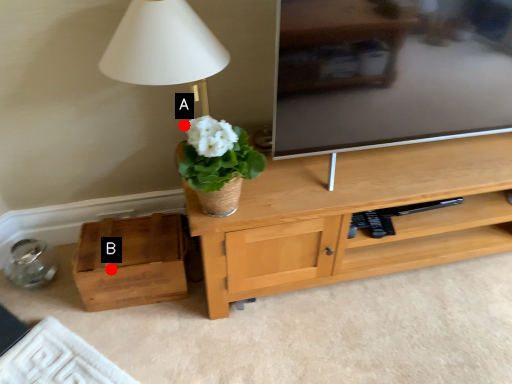
Question: Two points are circled on the image, labeled by A and B beside each circle. Among these points, which one is farthest from the camera?

Choices:
 (A) A is further
 (B) B is further

Answer: (A)